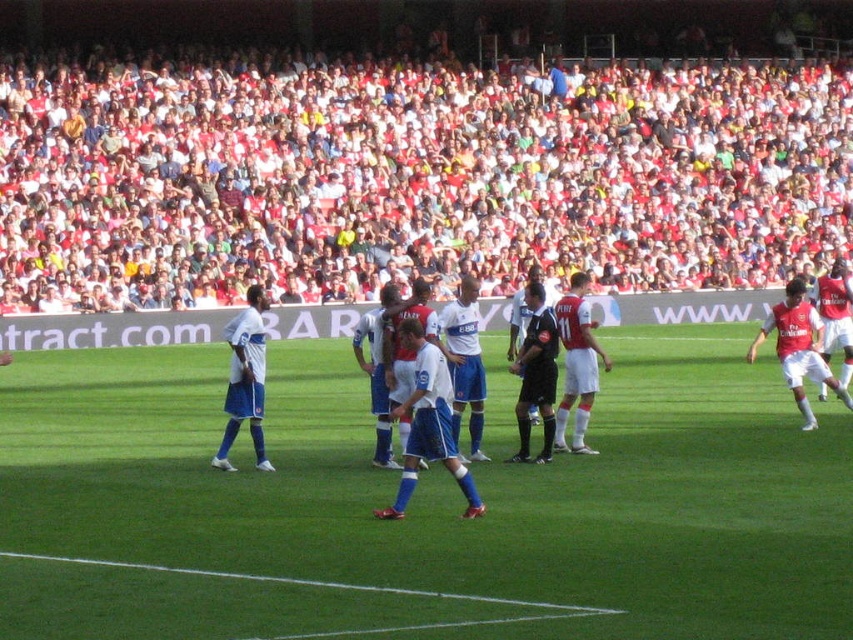
Question: Which of these objects is positioned farthest from the white cotton shirt at upper center?

Choices:
 (A) white smooth soccer players at center
 (B) white matte soccer player at left

Answer: (B)

Question: Is white smooth soccer players at center to the left of white matte soccer player at left from the viewer's perspective?

Choices:
 (A) yes
 (B) no

Answer: (B)

Question: Considering the relative positions of white smooth soccer players at center and white matte soccer player at left in the image provided, where is white smooth soccer players at center located with respect to white matte soccer player at left?

Choices:
 (A) above
 (B) below

Answer: (B)

Question: In this image, where is white smooth soccer players at center located relative to white matte soccer player at left?

Choices:
 (A) right
 (B) left

Answer: (A)

Question: Which point appears farthest from the camera in this image?

Choices:
 (A) (370, 292)
 (B) (258, 285)

Answer: (A)

Question: Which object is the farthest from the green grass field at center?

Choices:
 (A) white cotton shirt at upper center
 (B) white matte soccer player at left

Answer: (A)